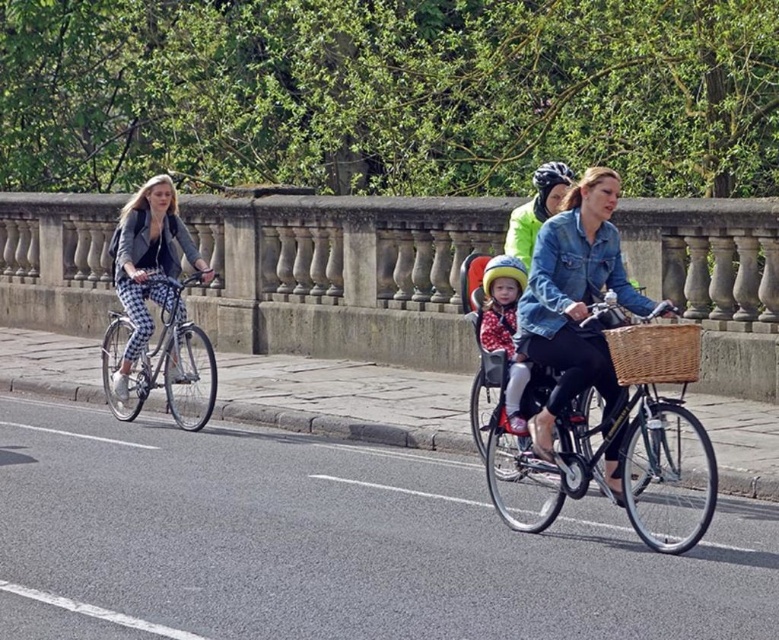
Between point (531, 433) and point (161, 273), which one is positioned behind?

Point (161, 273)

Is point (580, 346) positioned after point (132, 237)?

No, it is not.

Where is `denim jacket at center`? The image size is (779, 640). denim jacket at center is located at coordinates (573, 300).

Is matte black bicycle at center to the right of matte black helmet at upper center from the viewer's perspective?

No, matte black bicycle at center is not to the right of matte black helmet at upper center.

How distant is matte black bicycle at center from matte black helmet at upper center?

matte black bicycle at center and matte black helmet at upper center are 6.54 feet apart.

Measure the distance between point (524, 451) and camera.

Point (524, 451) and camera are 8.92 meters apart.

Locate an element on the screen. matte black bicycle at center is located at coordinates (591, 451).

Which is above, matte black bicycle at center or matte black bicycle at left?

Positioned higher is matte black bicycle at left.

Measure the distance between matte black bicycle at center and camera.

matte black bicycle at center and camera are 7.90 meters apart from each other.

I want to click on matte black bicycle at center, so click(x=591, y=451).

Locate an element on the screen. This screenshot has width=779, height=640. matte black bicycle at center is located at coordinates (591, 451).